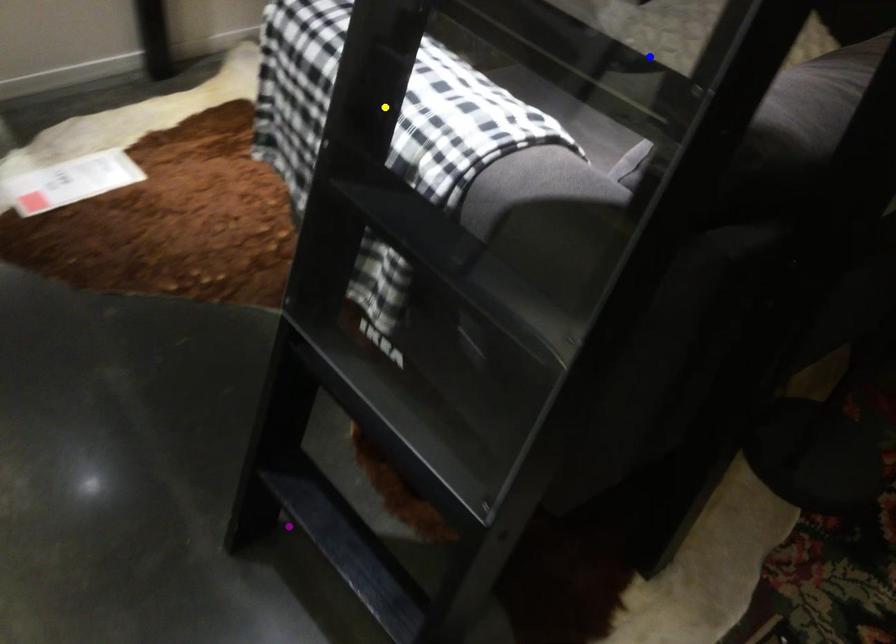
Order these from nearest to farthest:
purple point | yellow point | blue point

blue point
yellow point
purple point